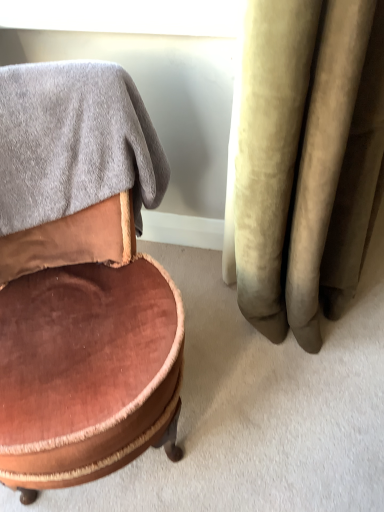
Question: Does white glossy window screen at upper center lie behind velvet brown ottoman at left?

Choices:
 (A) yes
 (B) no

Answer: (A)

Question: Would you consider white glossy window screen at upper center to be distant from velvet brown ottoman at left?

Choices:
 (A) yes
 (B) no

Answer: (B)

Question: From a real-world perspective, is white glossy window screen at upper center physically above velvet brown ottoman at left?

Choices:
 (A) yes
 (B) no

Answer: (A)

Question: Is white glossy window screen at upper center oriented towards velvet brown ottoman at left?

Choices:
 (A) no
 (B) yes

Answer: (B)

Question: Can we say white glossy window screen at upper center lies outside velvet brown ottoman at left?

Choices:
 (A) no
 (B) yes

Answer: (B)

Question: Is white glossy window screen at upper center bigger than velvet brown ottoman at left?

Choices:
 (A) yes
 (B) no

Answer: (B)

Question: Considering the relative positions of gray soft towel at upper left and white glossy window screen at upper center in the image provided, is gray soft towel at upper left to the left of white glossy window screen at upper center from the viewer's perspective?

Choices:
 (A) no
 (B) yes

Answer: (B)

Question: Would you say white glossy window screen at upper center is part of gray soft towel at upper left's contents?

Choices:
 (A) no
 (B) yes

Answer: (A)

Question: Is white glossy window screen at upper center at the back of gray soft towel at upper left?

Choices:
 (A) yes
 (B) no

Answer: (A)

Question: From a real-world perspective, is gray soft towel at upper left physically below white glossy window screen at upper center?

Choices:
 (A) yes
 (B) no

Answer: (A)

Question: Is gray soft towel at upper left far from white glossy window screen at upper center?

Choices:
 (A) no
 (B) yes

Answer: (A)

Question: Is gray soft towel at upper left thinner than white glossy window screen at upper center?

Choices:
 (A) yes
 (B) no

Answer: (B)

Question: Considering the relative sizes of white glossy window screen at upper center and gray soft towel at upper left in the image provided, is white glossy window screen at upper center shorter than gray soft towel at upper left?

Choices:
 (A) no
 (B) yes

Answer: (B)